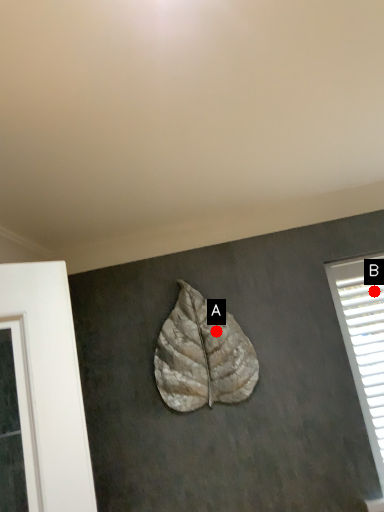
Question: Two points are circled on the image, labeled by A and B beside each circle. Among these points, which one is farthest from the camera?

Choices:
 (A) A is further
 (B) B is further

Answer: (B)